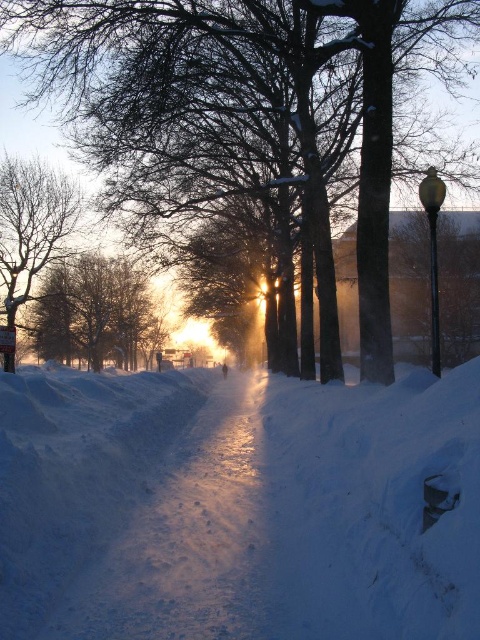
Who is shorter, white powdery snow at center or snowy branches at center?

With less height is white powdery snow at center.

Does white powdery snow at center have a lesser width compared to snowy branches at center?

Correct, white powdery snow at center's width is less than snowy branches at center's.

Describe the element at coordinates (237, 506) in the screenshot. I see `white powdery snow at center` at that location.

Image resolution: width=480 pixels, height=640 pixels. I want to click on white powdery snow at center, so click(237, 506).

Between point (416, 132) and point (129, 317), which one is positioned behind?

Point (129, 317)

Does snow-covered tree at center have a lesser width compared to snowy branches at center?

No, snow-covered tree at center is not thinner than snowy branches at center.

Does point (326, 24) lie in front of point (55, 324)?

Yes.

This screenshot has height=640, width=480. What are the coordinates of `snow-covered tree at center` in the screenshot? It's located at (259, 109).

Is point (326, 435) positioned after point (177, 106)?

No, it is not.

Measure the distance from white powdery snow at center to snow-covered tree at center.

white powdery snow at center and snow-covered tree at center are 7.05 meters apart from each other.

Is point (369, 493) closer to viewer compared to point (386, 317)?

That is True.

Find the location of a particular element. The height and width of the screenshot is (640, 480). white powdery snow at center is located at coordinates (237, 506).